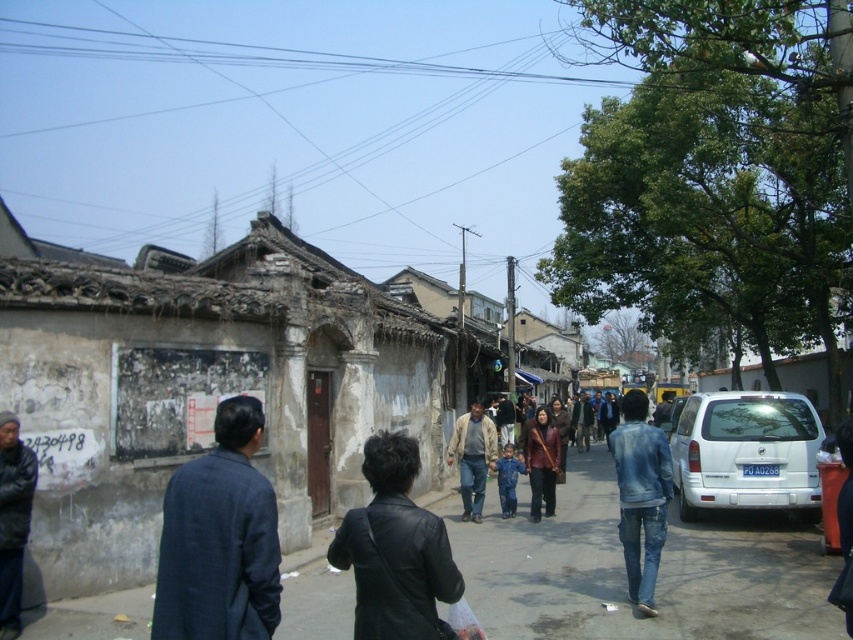
The width and height of the screenshot is (853, 640). What do you see at coordinates (395, 548) in the screenshot? I see `black leather jacket at center` at bounding box center [395, 548].

Is black leather jacket at center positioned in front of light brown fabric jacket at center?

Yes.

Does point (421, 621) lie in front of point (476, 499)?

Yes, it is.

Locate an element on the screen. The height and width of the screenshot is (640, 853). black leather jacket at center is located at coordinates (395, 548).

Between dark gray concrete alley at center and blue denim pants at center, which one is positioned lower?

Positioned lower is dark gray concrete alley at center.

Who is shorter, dark gray concrete alley at center or blue denim pants at center?

With less height is dark gray concrete alley at center.

Who is more forward, [489,600] or [511,468]?

Point [489,600] is more forward.

You are a GUI agent. You are given a task and a screenshot of the screen. Output one action in this format:
    pyautogui.click(x=<x>, y=<y>)
    Task: Click on the dark gray concrete alley at center
    This screenshot has width=853, height=640.
    Given the screenshot: What is the action you would take?
    pyautogui.click(x=624, y=570)

Can you confirm if light brown fabric jacket at center is bigger than blue denim pants at center?

Yes, light brown fabric jacket at center is bigger than blue denim pants at center.

Who is more forward, [496,442] or [498,464]?

Positioned in front is point [498,464].

This screenshot has width=853, height=640. What are the coordinates of `light brown fabric jacket at center` in the screenshot? It's located at (473, 456).